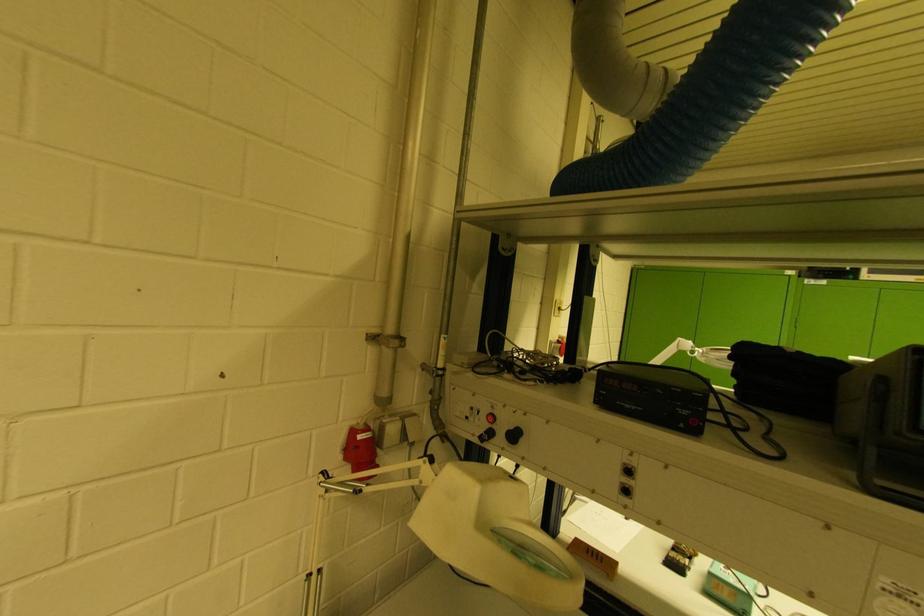
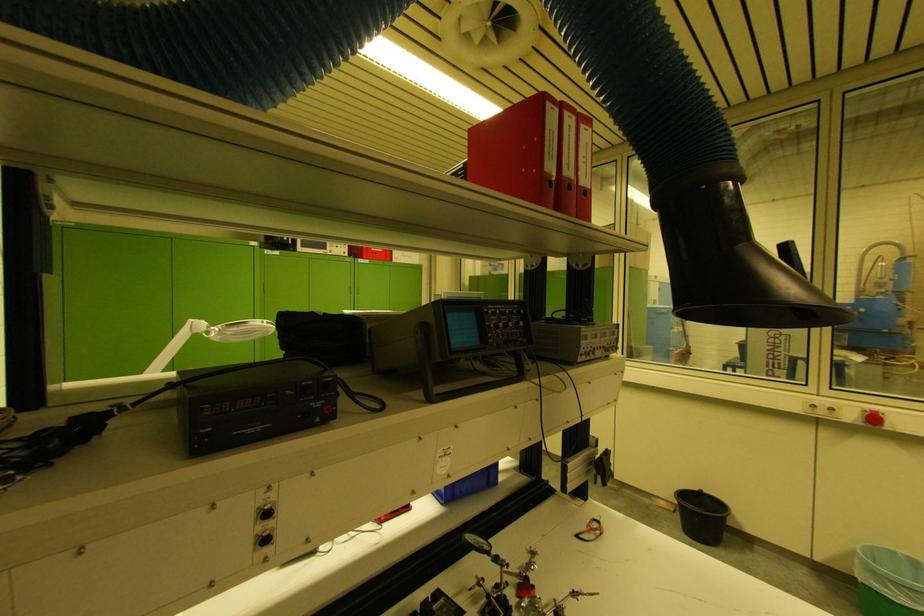
Question: The camera is either moving clockwise (left) or counter-clockwise (right) around the object. The first image is from the beginning of the video and the second image is from the end. Is the camera moving left or right when shooting the video?

Choices:
 (A) Left
 (B) Right

Answer: (A)